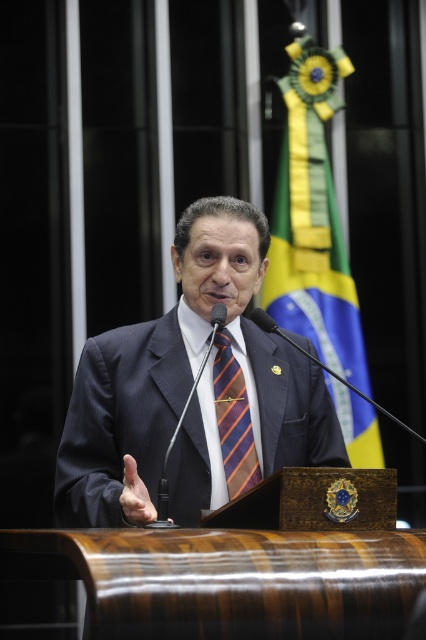
You are a fashion designer observing the man in the image. You need to determine if the dark blue suit at center can be seen above the orange striped tie at center when viewed from the front. Can you confirm this?

The dark blue suit at center is taller than orange striped tie at center, so yes, the dark blue suit at center can be seen above the orange striped tie at center when viewed from the front.

You are standing in the audience and want to take a photo of the podium. You notice two points on the podium at coordinates point (126, 404) and point (218, 381). Which point will appear larger in your photo?

Point (126, 404) is closer to the camera than point (218, 381). Therefore, point (126, 404) will appear larger in the photo.